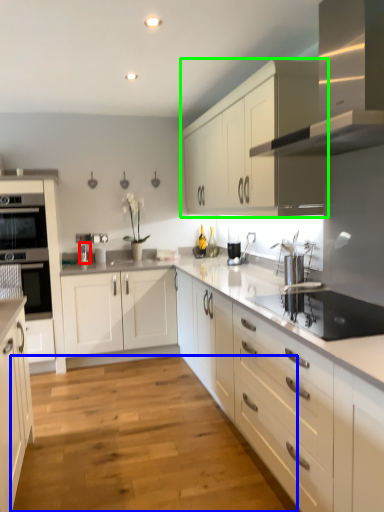
Question: Considering the real-world distances, which object is closest to faucet (highlighted by a red box)? plain (highlighted by a blue box) or cabinetry (highlighted by a green box).

Choices:
 (A) plain
 (B) cabinetry

Answer: (B)